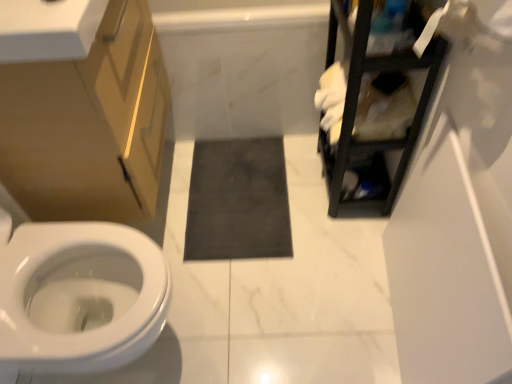
Question: Can you confirm if matte gold cabinet at left is thinner than white glossy countertop at upper left?

Choices:
 (A) no
 (B) yes

Answer: (A)

Question: From the image's perspective, is matte gold cabinet at left on white glossy countertop at upper left?

Choices:
 (A) no
 (B) yes

Answer: (A)

Question: Is white glossy countertop at upper left located within matte gold cabinet at left?

Choices:
 (A) no
 (B) yes

Answer: (A)

Question: Is matte gold cabinet at left behind white glossy countertop at upper left?

Choices:
 (A) no
 (B) yes

Answer: (B)

Question: Are matte gold cabinet at left and white glossy countertop at upper left located far from each other?

Choices:
 (A) yes
 (B) no

Answer: (B)

Question: Does matte gold cabinet at left have a greater height compared to white glossy countertop at upper left?

Choices:
 (A) yes
 (B) no

Answer: (A)

Question: Is the depth of matte gold cabinet at left less than that of white marble bath at center?

Choices:
 (A) yes
 (B) no

Answer: (A)

Question: Is matte gold cabinet at left at the left side of white marble bath at center?

Choices:
 (A) yes
 (B) no

Answer: (A)

Question: Can white marble bath at center be found inside matte gold cabinet at left?

Choices:
 (A) no
 (B) yes

Answer: (A)

Question: From the image's perspective, does matte gold cabinet at left appear higher than white marble bath at center?

Choices:
 (A) no
 (B) yes

Answer: (A)

Question: Is matte gold cabinet at left oriented away from white marble bath at center?

Choices:
 (A) yes
 (B) no

Answer: (B)

Question: Is matte gold cabinet at left directly adjacent to white marble bath at center?

Choices:
 (A) no
 (B) yes

Answer: (A)

Question: From the image's perspective, is white marble bath at center beneath dark gray matte bath mat at center?

Choices:
 (A) no
 (B) yes

Answer: (A)